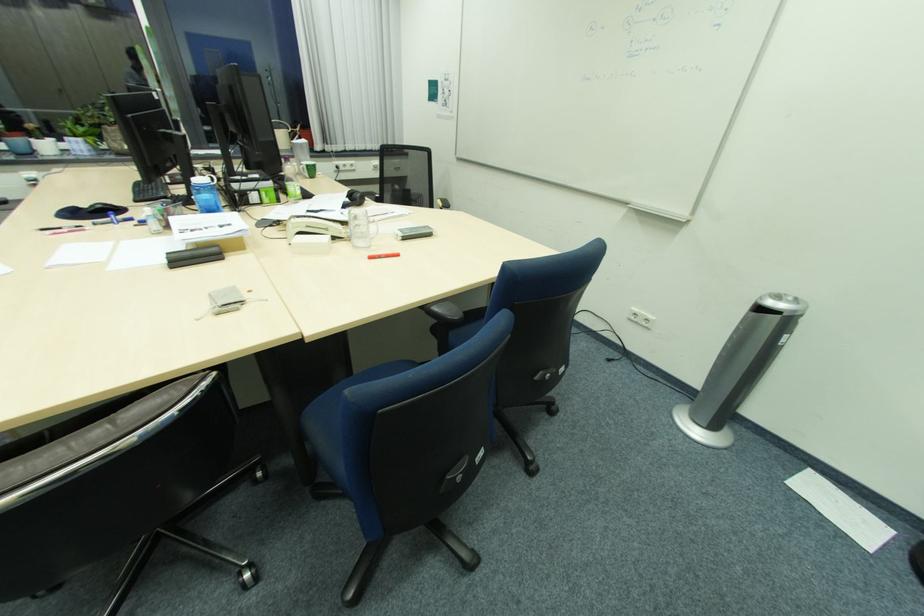
Find the location of a particular element. fan control buttons is located at coordinates (640, 317).